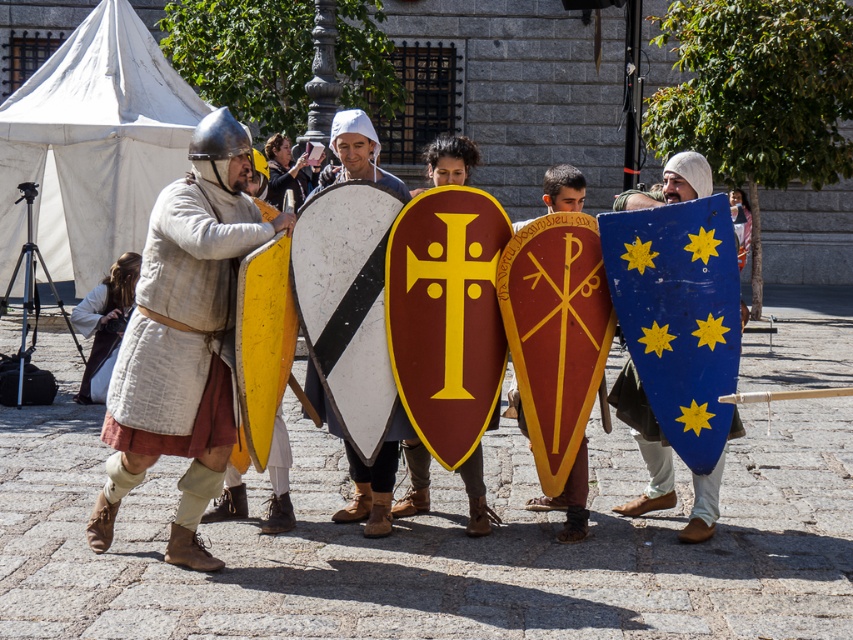
Looking at this image, is matte silver helmet at left to the right of white matte shield at center from the viewer's perspective?

In fact, matte silver helmet at left is to the left of white matte shield at center.

Between point (155, 451) and point (351, 476), which one is positioned in front?

Point (155, 451) is in front.

In order to click on matte silver helmet at left in this screenshot , I will do `click(184, 337)`.

Is the position of white matte shield at center less distant than that of matte red shield at center?

Yes.

Does white matte shield at center appear under matte red shield at center?

No.

Describe the element at coordinates (357, 152) in the screenshot. This screenshot has width=853, height=640. I see `white matte shield at center` at that location.

The height and width of the screenshot is (640, 853). In order to click on white matte shield at center in this screenshot , I will do `click(357, 152)`.

Locate an element on the screen. The height and width of the screenshot is (640, 853). matte white shield at center is located at coordinates [672, 182].

Does matte white shield at center have a lesser width compared to white matte shield at center?

No, matte white shield at center is not thinner than white matte shield at center.

Is point (572, 474) closer to camera compared to point (399, 412)?

No, it is not.

Find the location of a particular element. This screenshot has height=640, width=853. matte white shield at center is located at coordinates (672, 182).